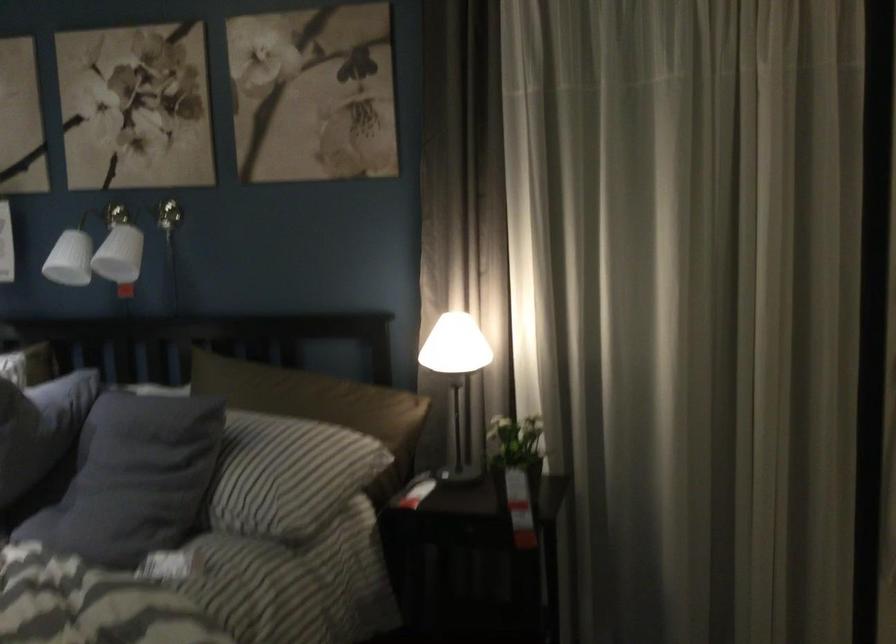
Where is `small flower vase`? The width and height of the screenshot is (896, 644). small flower vase is located at coordinates (515, 451).